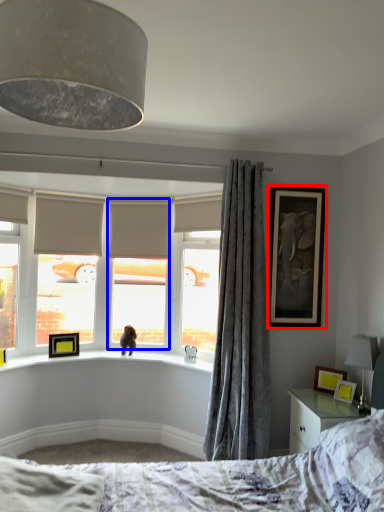
Question: Which object is closer to the camera taking this photo, picture frame (highlighted by a red box) or window screen (highlighted by a blue box)?

Choices:
 (A) picture frame
 (B) window screen

Answer: (A)